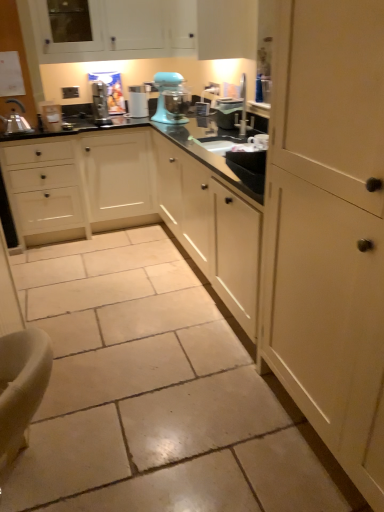
In order to face teal matte stand mixer at center, should I rotate leftwards or rightwards?

To face it directly, rotate left by 3.202 degrees.

The image size is (384, 512). Identify the location of brushed metal faucet at left. (16, 123).

Find the location of a particular element. This screenshot has height=512, width=384. white matte cabinet at upper center, which ranks as the second cabinetry in bottom-to-top order is located at coordinates (152, 30).

The height and width of the screenshot is (512, 384). Find the location of `white plastic toaster at left, acting as the first appliance starting from the left`. white plastic toaster at left, acting as the first appliance starting from the left is located at coordinates (51, 116).

How much space does metallic silver toaster at center, which ranks as the 1th appliance in right-to-left order, occupy horizontally?

It is 8.56 inches.

In order to click on white glossy sink at center in this screenshot , I will do `click(237, 125)`.

You are a GUI agent. You are given a task and a screenshot of the screen. Output one action in this format:
    pyautogui.click(x=<x>, y=<y>)
    Task: Click on the teal matte stand mixer at center
    The image size is (384, 512).
    Given the screenshot: What is the action you would take?
    pyautogui.click(x=170, y=98)

Where is `coffee machine on the left of metallic silver toaster at center, the 2th appliance when ordered from left to right`? coffee machine on the left of metallic silver toaster at center, the 2th appliance when ordered from left to right is located at coordinates (138, 102).

Considering the relative sizes of white plastic coffee machine at center and metallic silver toaster at center, the 2th appliance when ordered from left to right, in the image provided, is white plastic coffee machine at center shorter than metallic silver toaster at center, the 2th appliance when ordered from left to right,?

In fact, white plastic coffee machine at center may be taller than metallic silver toaster at center, the 2th appliance when ordered from left to right.

Who is smaller, white plastic coffee machine at center or metallic silver toaster at center, which ranks as the 1th appliance in right-to-left order?

With smaller size is white plastic coffee machine at center.

Consider the image. How different are the orientations of white matte cabinet at upper center, the 1th cabinetry in the left-to-right sequence, and black glossy countertop at center in degrees?

The angular difference between white matte cabinet at upper center, the 1th cabinetry in the left-to-right sequence, and black glossy countertop at center is 0.682 degrees.

Which is more to the right, white matte cabinet at upper center, the 1th cabinetry in the left-to-right sequence, or black glossy countertop at center?

black glossy countertop at center.

From a real-world perspective, is white matte cabinet at upper center, which appears as the second cabinetry when viewed from the front, under black glossy countertop at center?

No.

Is metallic silver toaster at center, which ranks as the 1th appliance in right-to-left order, in front of or behind teal matte stand mixer at center in the image?

metallic silver toaster at center, which ranks as the 1th appliance in right-to-left order, is in front of teal matte stand mixer at center.

In terms of width, does metallic silver toaster at center, the 2th appliance when ordered from left to right, look wider or thinner when compared to teal matte stand mixer at center?

In the image, metallic silver toaster at center, the 2th appliance when ordered from left to right, appears to be more narrow than teal matte stand mixer at center.

Looking at the image, does metallic silver toaster at center, which ranks as the 1th appliance in right-to-left order, seem bigger or smaller compared to teal matte stand mixer at center?

In the image, metallic silver toaster at center, which ranks as the 1th appliance in right-to-left order, appears to be smaller than teal matte stand mixer at center.

Is point (168, 97) in front of point (331, 393)?

No, (168, 97) is further to viewer.

From the image's perspective, is teal matte stand mixer at center located above matte cream cabinet at right, positioned as the first cabinetry in right-to-left order?

Yes, from the image's perspective, teal matte stand mixer at center is on top of matte cream cabinet at right, positioned as the first cabinetry in right-to-left order.

How many degrees apart are the facing directions of teal matte stand mixer at center and matte cream cabinet at right, which is the second cabinetry from top to bottom?

They differ by 115 degrees in their facing directions.

Is teal matte stand mixer at center in front of or behind matte cream cabinet at right, the second cabinetry in the back-to-front sequence, in the image?

In the image, teal matte stand mixer at center appears behind matte cream cabinet at right, the second cabinetry in the back-to-front sequence.

From the picture: Is there a large distance between matte cream cabinet at right, which is counted as the 1th cabinetry, starting from the bottom, and metallic silver toaster at center, which ranks as the 1th appliance in right-to-left order?

Yes, matte cream cabinet at right, which is counted as the 1th cabinetry, starting from the bottom, and metallic silver toaster at center, which ranks as the 1th appliance in right-to-left order, are located far from each other.

Is matte cream cabinet at right, which is the second cabinetry from top to bottom, looking in the opposite direction of metallic silver toaster at center, the 2th appliance when ordered from left to right?

matte cream cabinet at right, which is the second cabinetry from top to bottom, does not have its back to metallic silver toaster at center, the 2th appliance when ordered from left to right.

Does point (350, 111) come behind point (217, 109)?

No, (350, 111) is closer to viewer.

Is point (23, 108) positioned before point (132, 109)?

Yes, it is.

Is brushed metal faucet at left bigger or smaller than white plastic coffee machine at center?

brushed metal faucet at left is bigger than white plastic coffee machine at center.

Does brushed metal faucet at left have a greater height compared to white plastic coffee machine at center?

No.

Which of these two, brushed metal faucet at left or white plastic coffee machine at center, is thinner?

With smaller width is white plastic coffee machine at center.

Considering the relative sizes of white plastic coffee machine at center and teal matte stand mixer at center in the image provided, is white plastic coffee machine at center shorter than teal matte stand mixer at center?

Yes, white plastic coffee machine at center is shorter than teal matte stand mixer at center.

How different are the orientations of white plastic coffee machine at center and teal matte stand mixer at center in degrees?

The angular difference between white plastic coffee machine at center and teal matte stand mixer at center is 24 degrees.

Consider the image. Considering the sizes of white plastic coffee machine at center and teal matte stand mixer at center in the image, is white plastic coffee machine at center wider or thinner than teal matte stand mixer at center?

Considering their sizes, white plastic coffee machine at center looks slimmer than teal matte stand mixer at center.

From the image's perspective, which appliance is the 2nd one below the white plastic coffee machine at center? Please provide its 2D coordinates.

[(227, 112)]

Locate an element on the screen. The height and width of the screenshot is (512, 384). cabinetry lying behind the black glossy countertop at center is located at coordinates (152, 30).

In the scene shown: Looking at the image, which one is located further to black glossy countertop at center, brushed metal faucet at left or white matte cabinet at upper center, which is counted as the 1th cabinetry, starting from the back?

Based on the image, brushed metal faucet at left appears to be further to black glossy countertop at center.

When comparing their distances from white plastic toaster at left, acting as the first appliance starting from the left, does matte cream cabinet at right, the second cabinetry in the back-to-front sequence, or brushed metal faucet at left seem closer?

brushed metal faucet at left lies closer to white plastic toaster at left, acting as the first appliance starting from the left, than the other object.

From the image, which object appears to be farther from white matte cabinet at upper center, the first cabinetry when ordered from top to bottom, brushed metal faucet at left or white plastic coffee machine at center?

Among the two, brushed metal faucet at left is located further to white matte cabinet at upper center, the first cabinetry when ordered from top to bottom.

Based on their spatial positions, is black glossy countertop at center or white plastic coffee machine at center further from metallic silver toaster at center, which ranks as the 1th appliance in right-to-left order?

white plastic coffee machine at center is positioned further to the anchor metallic silver toaster at center, which ranks as the 1th appliance in right-to-left order.

From the image, which object appears to be farther from white plastic coffee machine at center, black glossy countertop at center or white matte cabinet at upper center, which ranks as the second cabinetry in bottom-to-top order?

black glossy countertop at center is positioned further to the anchor white plastic coffee machine at center.

Looking at the image, which one is located closer to teal matte stand mixer at center, white plastic toaster at left, acting as the first appliance starting from the left, or white plastic coffee machine at center?

white plastic coffee machine at center is positioned closer to the anchor teal matte stand mixer at center.

Which object lies further to the anchor point teal matte stand mixer at center, white plastic toaster at left, the 2th appliance positioned from the right, or brushed metal faucet at left?

brushed metal faucet at left is positioned further to the anchor teal matte stand mixer at center.

When comparing their distances from matte cream cabinet at right, the second cabinetry in the back-to-front sequence, does metallic silver toaster at center, which ranks as the 1th appliance in right-to-left order, or white plastic coffee machine at center seem further?

The object further to matte cream cabinet at right, the second cabinetry in the back-to-front sequence, is white plastic coffee machine at center.

Where is `cabinetry positioned between matte cream cabinet at right, which is counted as the 1th cabinetry, starting from the bottom, and teal matte stand mixer at center from near to far`? cabinetry positioned between matte cream cabinet at right, which is counted as the 1th cabinetry, starting from the bottom, and teal matte stand mixer at center from near to far is located at coordinates (152, 30).

Identify the location of sink between matte cream cabinet at right, positioned as the first cabinetry in right-to-left order, and black glossy countertop at center, along the z-axis. (237, 125).

The width and height of the screenshot is (384, 512). Find the location of `countertop between brushed metal faucet at left and metallic silver toaster at center, the 2th appliance when ordered from left to right`. countertop between brushed metal faucet at left and metallic silver toaster at center, the 2th appliance when ordered from left to right is located at coordinates (170, 141).

Locate an element on the screen. appliance between brushed metal faucet at left and metallic silver toaster at center, the 2th appliance when ordered from left to right, in the horizontal direction is located at coordinates (51, 116).